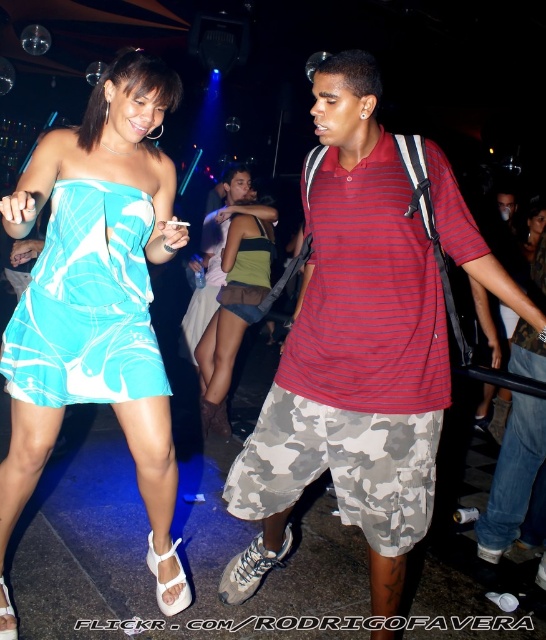
Measure the distance between point (364, 227) and camera.

Point (364, 227) and camera are 5.59 feet apart.

Is striped cotton polo shirt at center further to camera compared to turquoise satin dress at center?

Yes, striped cotton polo shirt at center is behind turquoise satin dress at center.

Which is behind, point (290, 381) or point (76, 196)?

Point (290, 381)

Find the location of a particular element. The width and height of the screenshot is (546, 640). striped cotton polo shirt at center is located at coordinates (352, 353).

Is striped cotton polo shirt at center shorter than green textured tank top at center?

No, striped cotton polo shirt at center is not shorter than green textured tank top at center.

This screenshot has height=640, width=546. Describe the element at coordinates (352, 353) in the screenshot. I see `striped cotton polo shirt at center` at that location.

Identify the location of striped cotton polo shirt at center. This screenshot has width=546, height=640. [x=352, y=353].

Does turquoise satin dress at center have a larger size compared to green jersey at center?

Yes.

Is point (52, 316) farther from viewer compared to point (259, 284)?

No, (52, 316) is closer to viewer.

Who is more distant from viewer, (31,433) or (225,291)?

Positioned behind is point (225,291).

You are a GUI agent. You are given a task and a screenshot of the screen. Output one action in this format:
    pyautogui.click(x=<x>, y=<y>)
    Task: Click on the turquoise satin dress at center
    This screenshot has height=640, width=546.
    Given the screenshot: What is the action you would take?
    pyautogui.click(x=97, y=301)